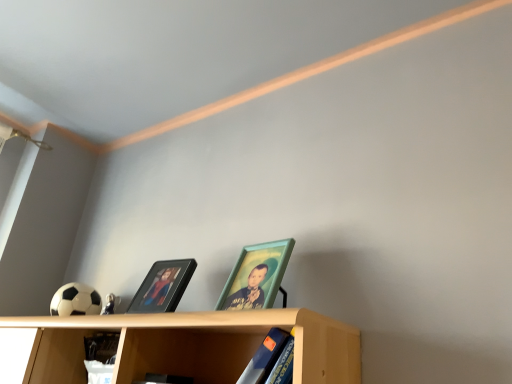
Question: Is teal wooden picture frame at center, the first picture frame from the right, situated inside blue matte book at lower center or outside?

Choices:
 (A) inside
 (B) outside

Answer: (B)

Question: Is point (248, 284) closer or farther from the camera than point (271, 327)?

Choices:
 (A) closer
 (B) farther

Answer: (B)

Question: Considering the real-world distances, which object is farthest from the light wood shelf at lower center?

Choices:
 (A) blue matte book at lower center
 (B) black glossy picture frame at center, marked as the first picture frame in a left-to-right arrangement
 (C) teal wooden picture frame at center, the first picture frame from the right

Answer: (A)

Question: Considering the real-world distances, which object is farthest from the black glossy picture frame at center, the 2th picture frame viewed from the right?

Choices:
 (A) teal wooden picture frame at center, positioned as the 2th picture frame in left-to-right order
 (B) blue matte book at lower center
 (C) light wood shelf at lower center

Answer: (B)